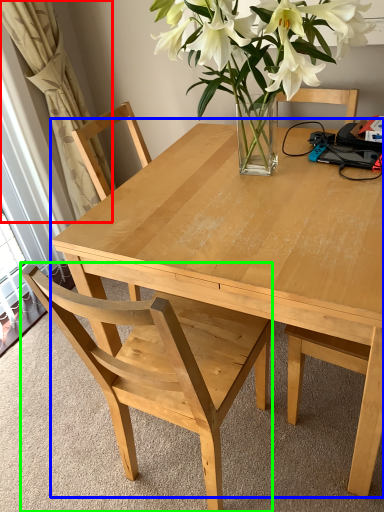
Question: Estimate the real-world distances between objects in this image. Which object is farther from curtain (highlighted by a red box), kitchen & dining room table (highlighted by a blue box) or chair (highlighted by a green box)?

Choices:
 (A) kitchen & dining room table
 (B) chair

Answer: (B)